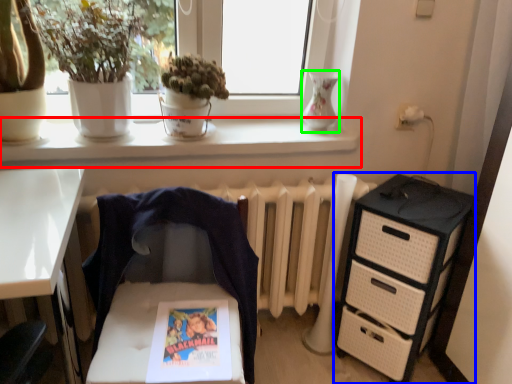
Question: Considering the real-world distances, which object is farthest from window sill (highlighted by a red box)? chest of drawers (highlighted by a blue box) or vase (highlighted by a green box)?

Choices:
 (A) chest of drawers
 (B) vase

Answer: (A)